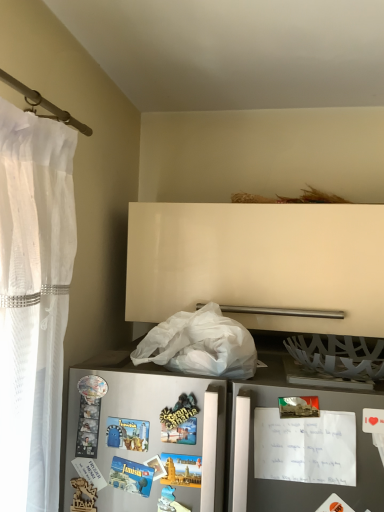
Question: From a real-world perspective, is metallic postcard at right located beneath metallic gray refrigerator at lower left?

Choices:
 (A) yes
 (B) no

Answer: (B)

Question: Does metallic postcard at right lie behind metallic gray refrigerator at lower left?

Choices:
 (A) no
 (B) yes

Answer: (B)

Question: Is metallic postcard at right turned away from metallic gray refrigerator at lower left?

Choices:
 (A) no
 (B) yes

Answer: (B)

Question: Is metallic postcard at right outside of metallic gray refrigerator at lower left?

Choices:
 (A) yes
 (B) no

Answer: (B)

Question: Are metallic postcard at right and metallic gray refrigerator at lower left located far from each other?

Choices:
 (A) no
 (B) yes

Answer: (A)

Question: Does metallic postcard at right contain metallic gray refrigerator at lower left?

Choices:
 (A) yes
 (B) no

Answer: (B)

Question: From a real-world perspective, is white matte plastic bag at lower center located higher than metallic gray refrigerator at lower left?

Choices:
 (A) no
 (B) yes

Answer: (B)

Question: Is metallic gray refrigerator at lower left at the back of white matte plastic bag at lower center?

Choices:
 (A) no
 (B) yes

Answer: (A)

Question: Is white matte plastic bag at lower center positioned beyond the bounds of metallic gray refrigerator at lower left?

Choices:
 (A) no
 (B) yes

Answer: (B)

Question: Is white matte plastic bag at lower center at the left side of metallic gray refrigerator at lower left?

Choices:
 (A) no
 (B) yes

Answer: (B)

Question: Could metallic gray refrigerator at lower left be considered to be inside white matte plastic bag at lower center?

Choices:
 (A) no
 (B) yes

Answer: (A)

Question: Is white matte plastic bag at lower center smaller than metallic gray refrigerator at lower left?

Choices:
 (A) no
 (B) yes

Answer: (A)

Question: Is metallic postcard at right thinner than white matte plastic bag at lower center?

Choices:
 (A) yes
 (B) no

Answer: (A)